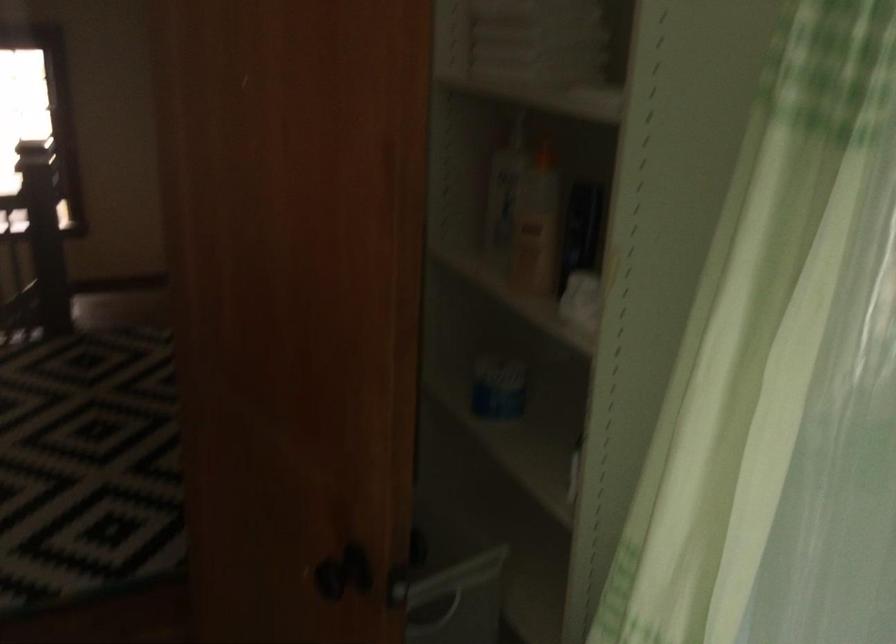
This screenshot has height=644, width=896. What do you see at coordinates (537, 225) in the screenshot? I see `a white lotion bottle` at bounding box center [537, 225].